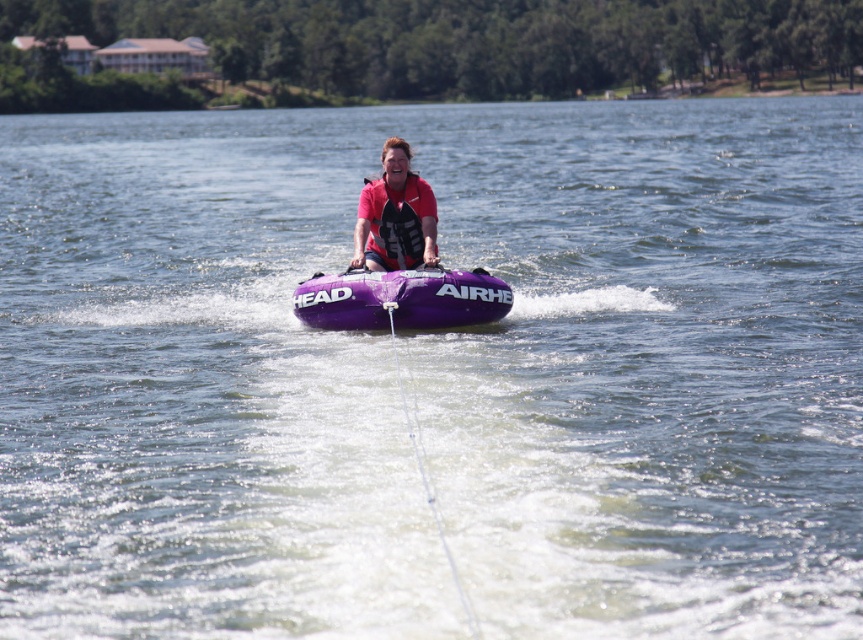
Is point (477, 280) less distant than point (395, 182)?

Yes, it is.

Does purple inflatable tube at center appear on the right side of matte red life vest at center?

Correct, you'll find purple inflatable tube at center to the right of matte red life vest at center.

Locate an element on the screen. The height and width of the screenshot is (640, 863). purple inflatable tube at center is located at coordinates (401, 298).

Where is `purple inflatable tube at center`? purple inflatable tube at center is located at coordinates (401, 298).